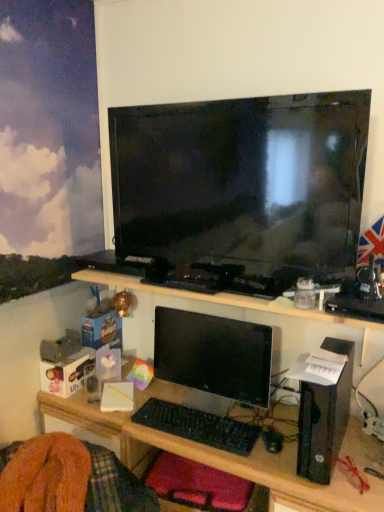
Where is `free region on the left part of black plastic computer at right`? The height and width of the screenshot is (512, 384). free region on the left part of black plastic computer at right is located at coordinates (268, 444).